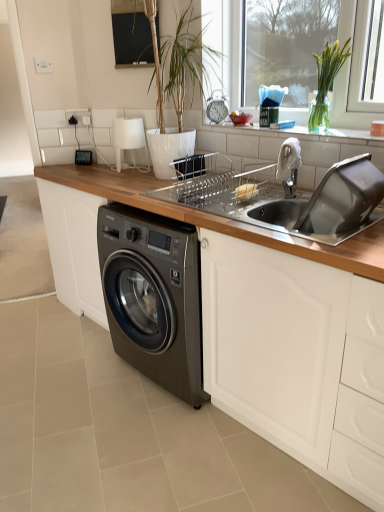
Question: Is wooden at lower left smaller than green glass vase at upper right?

Choices:
 (A) yes
 (B) no

Answer: (B)

Question: Is wooden at lower left closer to the viewer compared to green glass vase at upper right?

Choices:
 (A) yes
 (B) no

Answer: (A)

Question: From the image's perspective, would you say wooden at lower left is shown under green glass vase at upper right?

Choices:
 (A) no
 (B) yes

Answer: (B)

Question: From the image's perspective, is wooden at lower left above green glass vase at upper right?

Choices:
 (A) no
 (B) yes

Answer: (A)

Question: Does wooden at lower left have a lesser width compared to green glass vase at upper right?

Choices:
 (A) no
 (B) yes

Answer: (A)

Question: From a real-world perspective, does wooden at lower left stand above green glass vase at upper right?

Choices:
 (A) no
 (B) yes

Answer: (A)

Question: Is green glass vase at upper right turned away from wooden at lower left?

Choices:
 (A) no
 (B) yes

Answer: (A)

Question: Is green glass vase at upper right wider than wooden at lower left?

Choices:
 (A) no
 (B) yes

Answer: (A)

Question: Is green glass vase at upper right positioned behind wooden at lower left?

Choices:
 (A) yes
 (B) no

Answer: (A)

Question: Is green glass vase at upper right next to wooden at lower left?

Choices:
 (A) yes
 (B) no

Answer: (B)

Question: Is wooden at lower left surrounded by green glass vase at upper right?

Choices:
 (A) no
 (B) yes

Answer: (A)

Question: From a real-world perspective, is green glass vase at upper right on wooden at lower left?

Choices:
 (A) yes
 (B) no

Answer: (A)

Question: From the image's perspective, does silver metallic faucet at upper right appear higher than metallic silver clock at center?

Choices:
 (A) yes
 (B) no

Answer: (B)